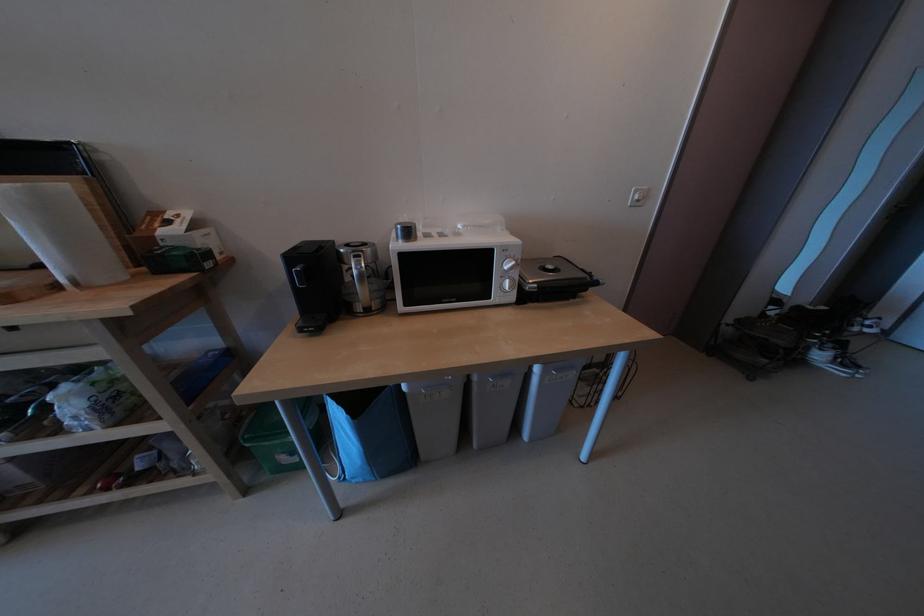
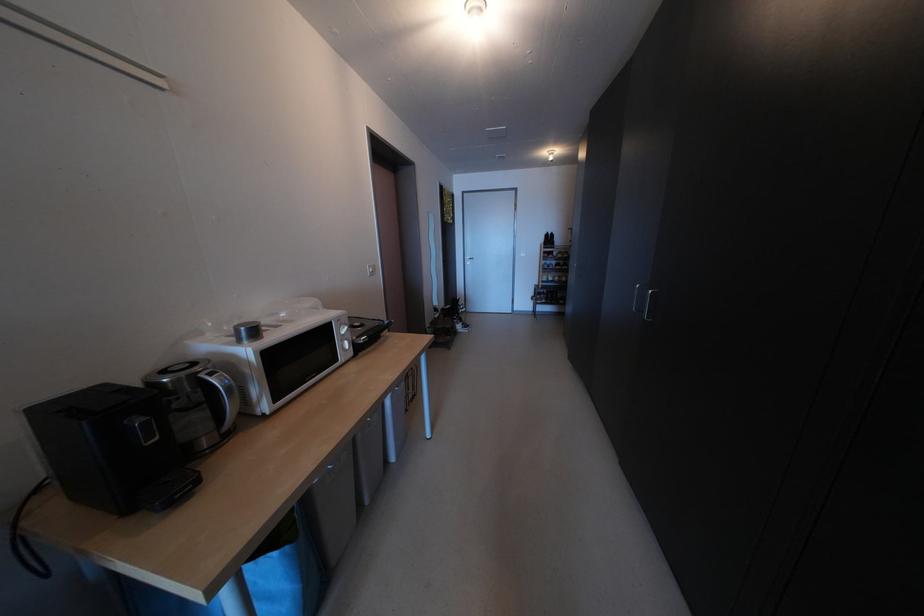
Question: How did the camera likely rotate?

Choices:
 (A) Left
 (B) Right
 (C) Up
 (D) Down

Answer: (B)